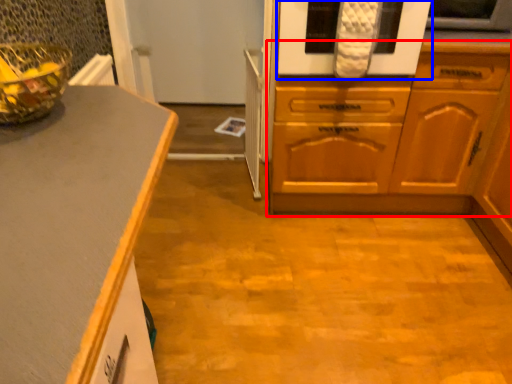
Question: Among these objects, which one is farthest to the camera, cabinetry (highlighted by a red box) or oven (highlighted by a blue box)?

Choices:
 (A) cabinetry
 (B) oven

Answer: (B)